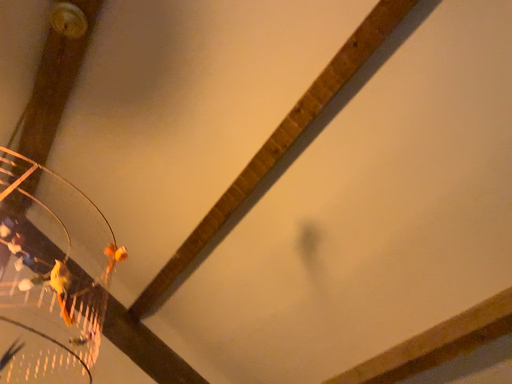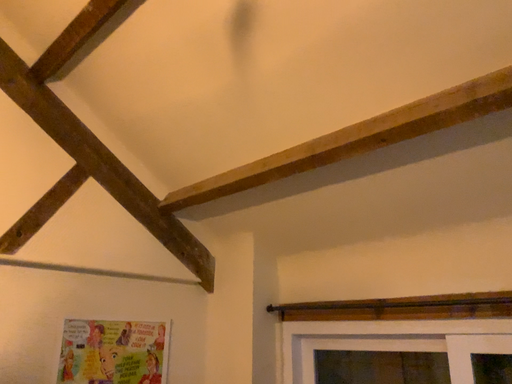
Question: Which way did the camera rotate in the video?

Choices:
 (A) rotated right
 (B) rotated left

Answer: (A)